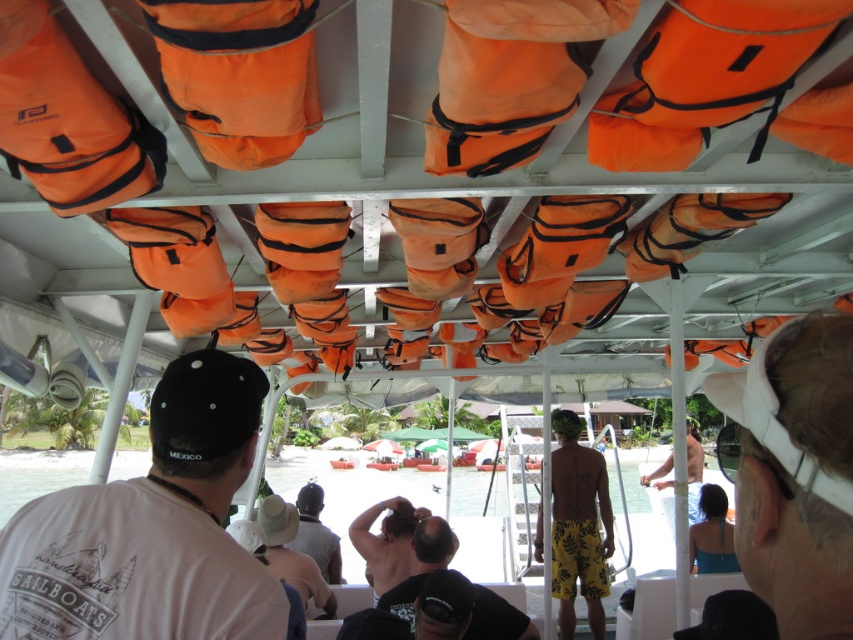
Question: Is white matte shirt at center to the left of white matte sunglasses at upper right from the viewer's perspective?

Choices:
 (A) no
 (B) yes

Answer: (B)

Question: Which of the following is the closest to the observer?

Choices:
 (A) (383, 536)
 (B) (334, 547)
 (C) (250, 369)
 (D) (299, 586)

Answer: (C)

Question: Does white matte shirt at center have a larger size compared to yellow textured shorts at center?

Choices:
 (A) no
 (B) yes

Answer: (A)

Question: Which point appears farthest from the camera in this image?

Choices:
 (A) coord(360,532)
 (B) coord(558,566)

Answer: (B)

Question: Can you confirm if black matte shirt at center is wider than beige fabric hat at center?

Choices:
 (A) yes
 (B) no

Answer: (B)

Question: Which of the following is the closest to the observer?

Choices:
 (A) shiny brown hair at center
 (B) yellow floral shorts at center
 (C) beige fabric hat at center
 (D) black matte shirt at center

Answer: (D)